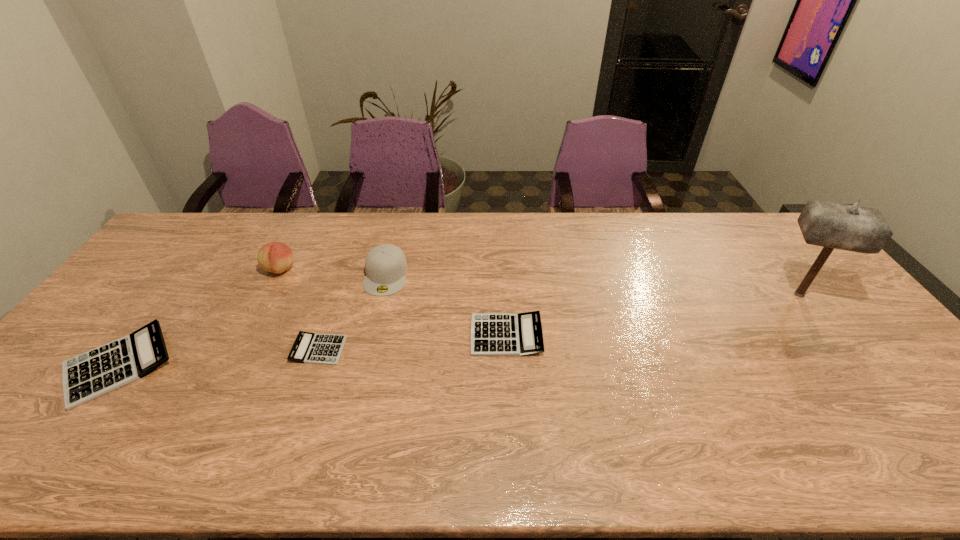
Please point out where to position a new calculator on the right to maintain spacing. Please provide its 2D coordinates. Your answer should be formatted as a tuple, i.e. [(x, y)], where the tuple contains the x and y coordinates of a point satisfying the conditions above.

[(683, 322)]